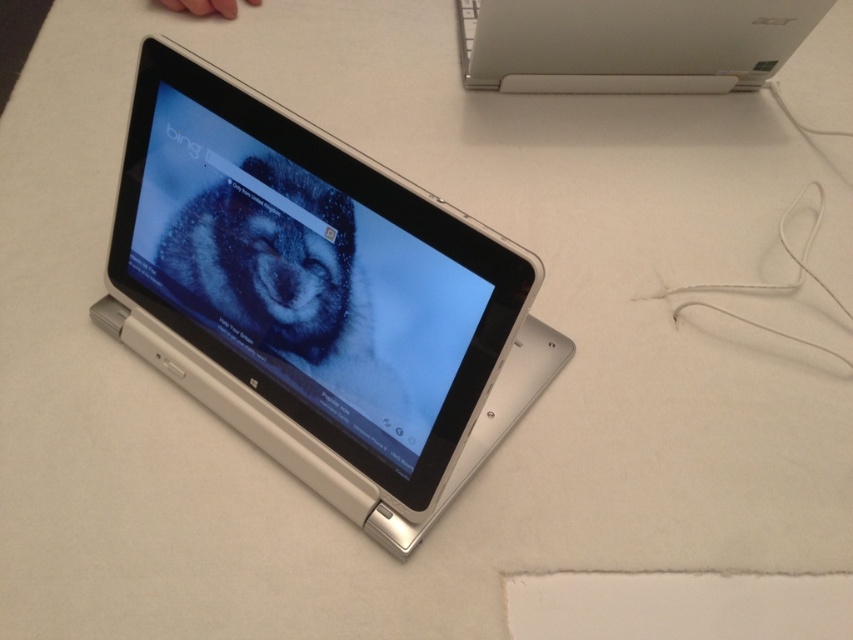
You are setting up a workspace and need to place both the white plastic tablet at center and the white plastic laptop at upper center on a desk. Based on their positions in the image, which device is closer to the edge of the desk?

The white plastic tablet at center is closer to the edge of the desk because it is located below the white plastic laptop at upper center, meaning it is positioned lower on the desk and thus nearer to the edge.

Based on the photo, you are trying to clean the desk and need to move the white plastic tablet at center and the white plastic laptop at upper center. Since they are both white and on the same surface, how can you tell which one is closer to you?

The white plastic tablet at center is closer to you because it is in front of the white plastic laptop at upper center.

Where is the white plastic tablet at center located in the image?

The white plastic tablet at center is located at point (306,285) in the image.